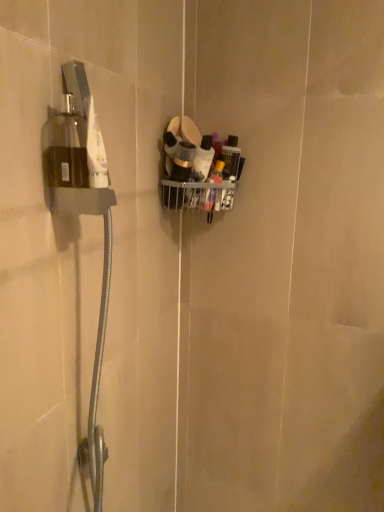
How much space does translucent plastic bottles at upper right, which appears as the 2th toiletry when viewed from the left, occupy vertically?

6.19 inches.

The image size is (384, 512). I want to click on translucent plastic bottles at upper right, which appears as the 2th toiletry when viewed from the left, so click(x=203, y=159).

What do you see at coordinates (203, 159) in the screenshot?
I see `translucent plastic bottles at upper right, which appears as the 2th toiletry when viewed from the left` at bounding box center [203, 159].

Consider the image. Measure the distance between point (200,170) and camera.

The depth of point (200,170) is 1.08 meters.

In order to face translucent plastic bottles at upper right, which appears as the 2th toiletry when viewed from the left, should I rotate leftwards or rightwards?

To align with it, rotate right about 1.674°.

Identify the location of matte black container at center, the first toiletry when ordered from left to right. This screenshot has height=512, width=384. (183, 162).

What do you see at coordinates (183, 162) in the screenshot?
I see `matte black container at center, the first toiletry when ordered from left to right` at bounding box center [183, 162].

How much space does matte black container at center, the first toiletry when ordered from left to right, occupy vertically?

The height of matte black container at center, the first toiletry when ordered from left to right, is 17.49 centimeters.

The image size is (384, 512). I want to click on translucent plastic bottles at upper right, which ranks as the 1th toiletry in right-to-left order, so click(203, 159).

Is translucent plastic bottles at upper right, which ranks as the 1th toiletry in right-to-left order, to the left of matte black container at center, the first toiletry when ordered from left to right, from the viewer's perspective?

No.

Considering the positions of objects translucent plastic bottles at upper right, which appears as the 2th toiletry when viewed from the left, and matte black container at center, the first toiletry when ordered from left to right, in the image provided, who is behind, translucent plastic bottles at upper right, which appears as the 2th toiletry when viewed from the left, or matte black container at center, the first toiletry when ordered from left to right,?

translucent plastic bottles at upper right, which appears as the 2th toiletry when viewed from the left, is behind.

Considering the positions of points (196, 158) and (182, 146), is point (196, 158) farther from camera compared to point (182, 146)?

Yes, point (196, 158) is behind point (182, 146).

From the image's perspective, is translucent plastic bottles at upper right, which appears as the 2th toiletry when viewed from the left, located above or below matte black container at center, marked as the 2th toiletry in a right-to-left arrangement?

Clearly, from the image's perspective, translucent plastic bottles at upper right, which appears as the 2th toiletry when viewed from the left, is below matte black container at center, marked as the 2th toiletry in a right-to-left arrangement.

From a real-world perspective, is translucent plastic bottles at upper right, which appears as the 2th toiletry when viewed from the left, positioned under matte black container at center, marked as the 2th toiletry in a right-to-left arrangement, based on gravity?

Indeed, from a real-world perspective, translucent plastic bottles at upper right, which appears as the 2th toiletry when viewed from the left, is positioned beneath matte black container at center, marked as the 2th toiletry in a right-to-left arrangement.

Is translucent plastic bottles at upper right, which appears as the 2th toiletry when viewed from the left, wider than matte black container at center, the first toiletry when ordered from left to right?

No, translucent plastic bottles at upper right, which appears as the 2th toiletry when viewed from the left, is not wider than matte black container at center, the first toiletry when ordered from left to right.

Considering the sizes of objects translucent plastic bottles at upper right, which appears as the 2th toiletry when viewed from the left, and matte black container at center, the first toiletry when ordered from left to right, in the image provided, who is taller, translucent plastic bottles at upper right, which appears as the 2th toiletry when viewed from the left, or matte black container at center, the first toiletry when ordered from left to right,?

matte black container at center, the first toiletry when ordered from left to right, is taller.

Considering the sizes of objects translucent plastic bottles at upper right, which appears as the 2th toiletry when viewed from the left, and matte black container at center, marked as the 2th toiletry in a right-to-left arrangement, in the image provided, who is bigger, translucent plastic bottles at upper right, which appears as the 2th toiletry when viewed from the left, or matte black container at center, marked as the 2th toiletry in a right-to-left arrangement,?

matte black container at center, marked as the 2th toiletry in a right-to-left arrangement, is bigger.

Would you say translucent plastic bottles at upper right, which ranks as the 1th toiletry in right-to-left order, is outside matte black container at center, marked as the 2th toiletry in a right-to-left arrangement?

Yes, translucent plastic bottles at upper right, which ranks as the 1th toiletry in right-to-left order, is located beyond the bounds of matte black container at center, marked as the 2th toiletry in a right-to-left arrangement.

Are translucent plastic bottles at upper right, which ranks as the 1th toiletry in right-to-left order, and matte black container at center, the first toiletry when ordered from left to right, located far from each other?

No, translucent plastic bottles at upper right, which ranks as the 1th toiletry in right-to-left order, is not far from matte black container at center, the first toiletry when ordered from left to right.

In the scene shown: Could you tell me if translucent plastic bottles at upper right, which ranks as the 1th toiletry in right-to-left order, is facing matte black container at center, marked as the 2th toiletry in a right-to-left arrangement?

No, translucent plastic bottles at upper right, which ranks as the 1th toiletry in right-to-left order, is not aimed at matte black container at center, marked as the 2th toiletry in a right-to-left arrangement.

Measure the distance between translucent plastic bottles at upper right, which ranks as the 1th toiletry in right-to-left order, and matte black container at center, marked as the 2th toiletry in a right-to-left arrangement.

They are 1.65 inches apart.

Identify the location of toiletry in front of the translucent plastic bottles at upper right, which ranks as the 1th toiletry in right-to-left order. (183, 162).

Considering the positions of objects matte black container at center, the first toiletry when ordered from left to right, and translucent plastic bottles at upper right, which ranks as the 1th toiletry in right-to-left order, in the image provided, who is more to the right, matte black container at center, the first toiletry when ordered from left to right, or translucent plastic bottles at upper right, which ranks as the 1th toiletry in right-to-left order,?

From the viewer's perspective, translucent plastic bottles at upper right, which ranks as the 1th toiletry in right-to-left order, appears more on the right side.

In the image, is matte black container at center, the first toiletry when ordered from left to right, positioned in front of or behind translucent plastic bottles at upper right, which ranks as the 1th toiletry in right-to-left order?

matte black container at center, the first toiletry when ordered from left to right, is in front of translucent plastic bottles at upper right, which ranks as the 1th toiletry in right-to-left order.

Is point (180, 163) farther from viewer compared to point (209, 155)?

No, (180, 163) is closer to viewer.

From the image's perspective, between matte black container at center, the first toiletry when ordered from left to right, and translucent plastic bottles at upper right, which ranks as the 1th toiletry in right-to-left order, which one is located above?

matte black container at center, the first toiletry when ordered from left to right.

From a real-world perspective, who is located higher, matte black container at center, the first toiletry when ordered from left to right, or translucent plastic bottles at upper right, which appears as the 2th toiletry when viewed from the left?

From a 3D spatial view, matte black container at center, the first toiletry when ordered from left to right, is above.

Which of these two, matte black container at center, marked as the 2th toiletry in a right-to-left arrangement, or translucent plastic bottles at upper right, which appears as the 2th toiletry when viewed from the left, is thinner?

translucent plastic bottles at upper right, which appears as the 2th toiletry when viewed from the left.

In the scene shown: Is matte black container at center, marked as the 2th toiletry in a right-to-left arrangement, shorter than translucent plastic bottles at upper right, which ranks as the 1th toiletry in right-to-left order?

In fact, matte black container at center, marked as the 2th toiletry in a right-to-left arrangement, may be taller than translucent plastic bottles at upper right, which ranks as the 1th toiletry in right-to-left order.

From the picture: In terms of size, does matte black container at center, the first toiletry when ordered from left to right, appear bigger or smaller than translucent plastic bottles at upper right, which appears as the 2th toiletry when viewed from the left?

matte black container at center, the first toiletry when ordered from left to right, is bigger than translucent plastic bottles at upper right, which appears as the 2th toiletry when viewed from the left.

Can we say matte black container at center, marked as the 2th toiletry in a right-to-left arrangement, lies outside translucent plastic bottles at upper right, which appears as the 2th toiletry when viewed from the left?

Absolutely, matte black container at center, marked as the 2th toiletry in a right-to-left arrangement, is external to translucent plastic bottles at upper right, which appears as the 2th toiletry when viewed from the left.

Does matte black container at center, the first toiletry when ordered from left to right, touch translucent plastic bottles at upper right, which appears as the 2th toiletry when viewed from the left?

Yes, matte black container at center, the first toiletry when ordered from left to right, is in contact with translucent plastic bottles at upper right, which appears as the 2th toiletry when viewed from the left.

Is matte black container at center, the first toiletry when ordered from left to right, facing towards translucent plastic bottles at upper right, which appears as the 2th toiletry when viewed from the left?

No, matte black container at center, the first toiletry when ordered from left to right, is not aimed at translucent plastic bottles at upper right, which appears as the 2th toiletry when viewed from the left.

Find the location of `toiletry that appears above the translucent plastic bottles at upper right, which appears as the 2th toiletry when viewed from the left (from the image's perspective)`. toiletry that appears above the translucent plastic bottles at upper right, which appears as the 2th toiletry when viewed from the left (from the image's perspective) is located at coordinates (183, 162).

I want to click on toiletry that is under the matte black container at center, the first toiletry when ordered from left to right (from a real-world perspective), so click(203, 159).

Where is `toiletry above the translucent plastic bottles at upper right, which appears as the 2th toiletry when viewed from the left (from the image's perspective)`? toiletry above the translucent plastic bottles at upper right, which appears as the 2th toiletry when viewed from the left (from the image's perspective) is located at coordinates (183, 162).